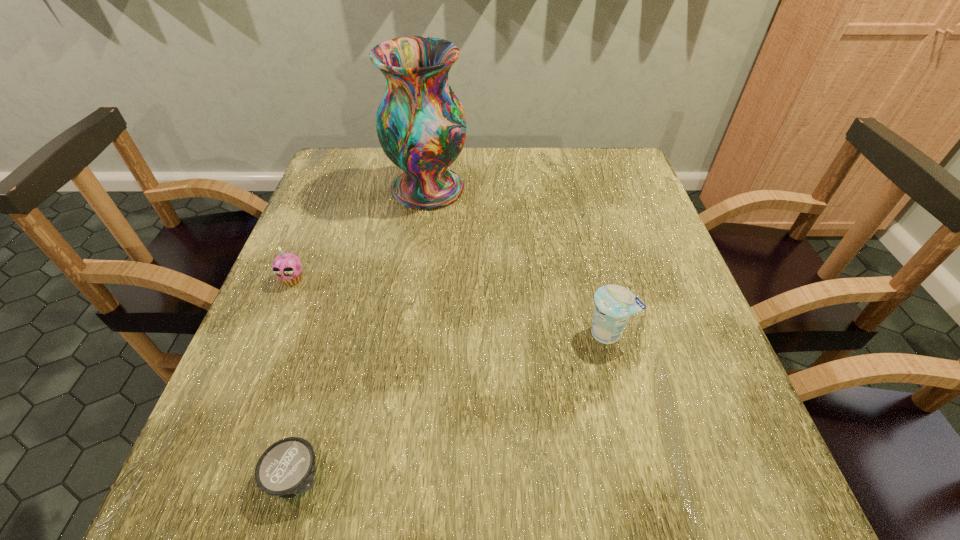
Identify the location of vacant space located on the face of the third nearest object. The width and height of the screenshot is (960, 540). (276, 322).

The height and width of the screenshot is (540, 960). In order to click on vacant region located 0.100m on the left of the left yogurt in this screenshot , I will do `click(202, 477)`.

The height and width of the screenshot is (540, 960). I want to click on object that is positioned at the far edge, so click(x=421, y=125).

Where is `object located at the near edge`? This screenshot has height=540, width=960. object located at the near edge is located at coordinates (286, 469).

The height and width of the screenshot is (540, 960). In order to click on cupcake at the left edge in this screenshot , I will do `click(287, 267)`.

Locate an element on the screen. yogurt located in the left edge section of the desktop is located at coordinates (286, 469).

Locate an element on the screen. The width and height of the screenshot is (960, 540). object at the right edge is located at coordinates (614, 304).

I want to click on object located at the near left corner, so click(286, 469).

In the image, there is a desktop. At what (x,y) coordinates should I click in order to perform the action: click on vacant space at the far edge. Please return your answer as a coordinate pair (x, y). This screenshot has width=960, height=540. Looking at the image, I should click on (536, 163).

The width and height of the screenshot is (960, 540). Find the location of `free space at the left edge of the desktop`. free space at the left edge of the desktop is located at coordinates (333, 270).